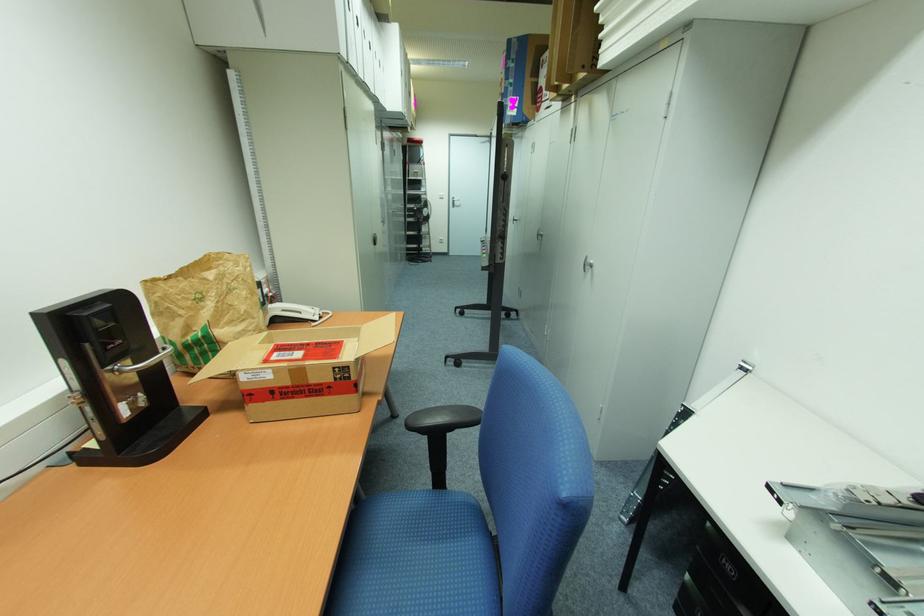
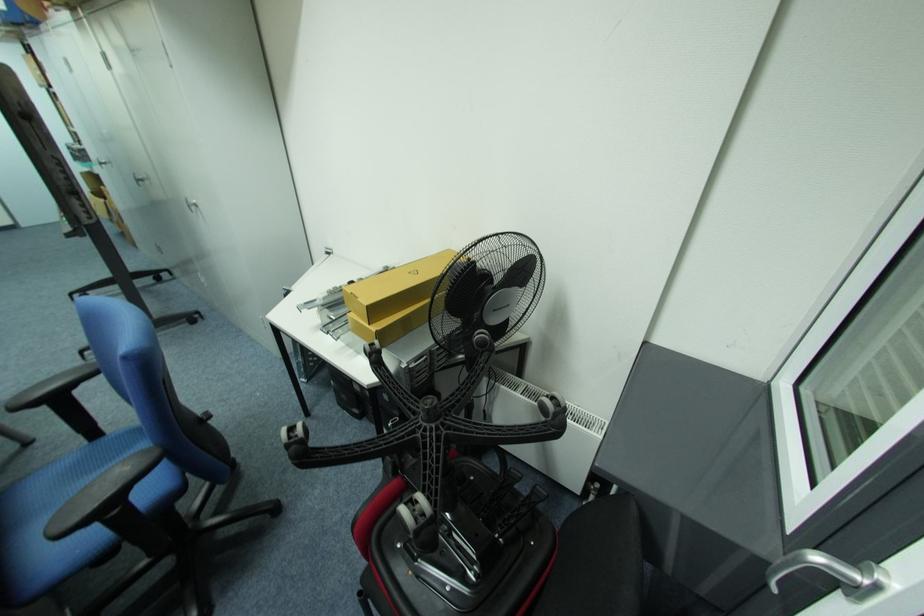
Where in the second image is the point corresponding to the point at 542,233 from the first image?

(141, 179)